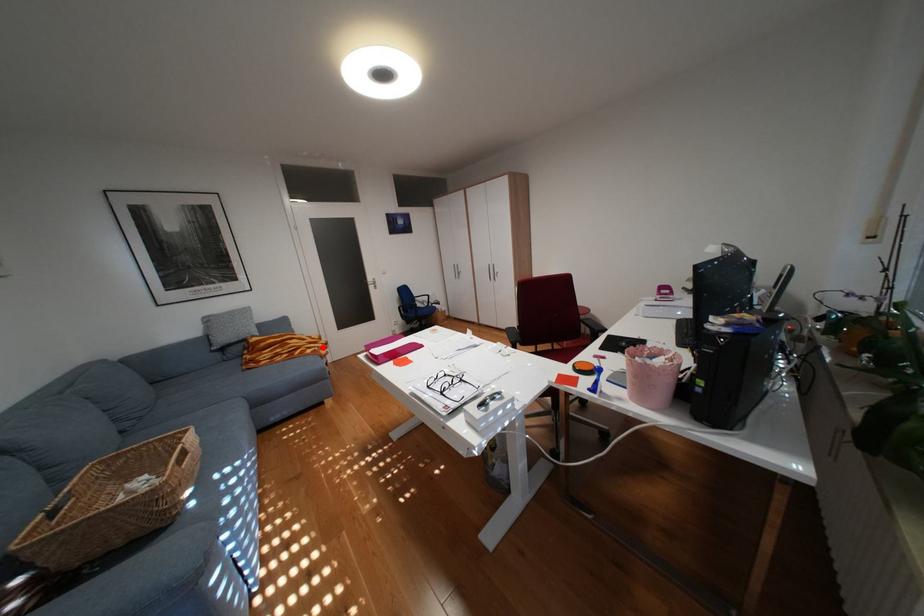
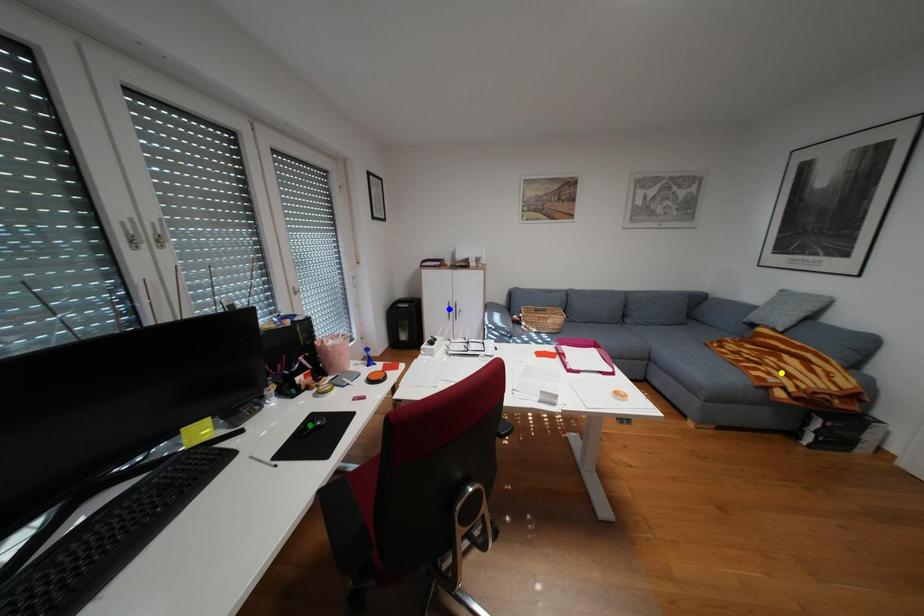
Question: I am providing you with two images of the same scene from different viewpoints. A red point is marked on the first image. You are given multiple points on the second image. Can you choose the point in image 2 that corresponds to the point in image 1?

Choices:
 (A) blue point
 (B) green point
 (C) yellow point

Answer: (C)